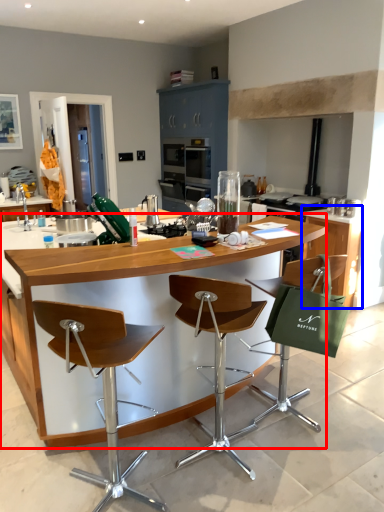
Question: Among these objects, which one is farthest to the camera, table (highlighted by a red box) or cabinetry (highlighted by a blue box)?

Choices:
 (A) table
 (B) cabinetry

Answer: (B)